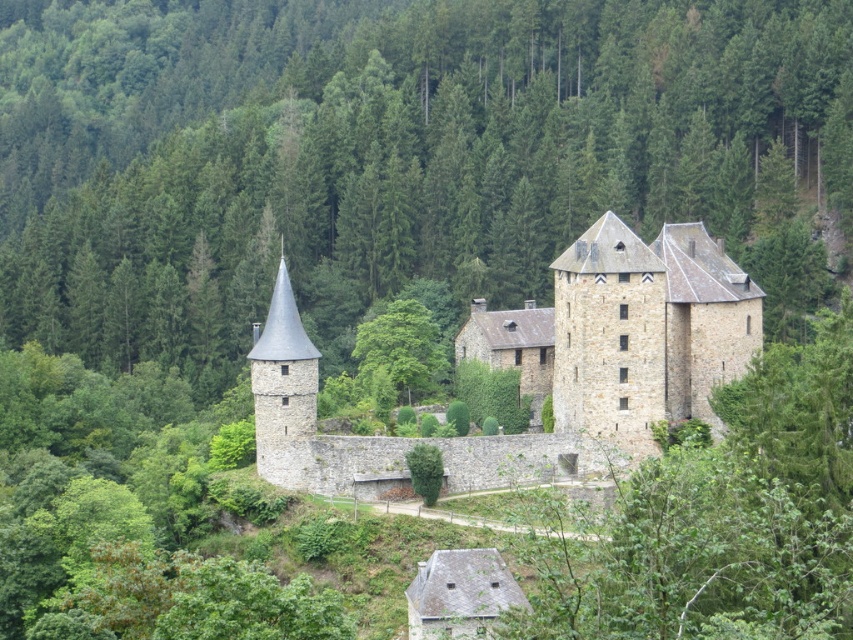
Question: Does green leafy tree at center appear over stone spire at left?

Choices:
 (A) yes
 (B) no

Answer: (A)

Question: Which point appears closest to the camera in this image?

Choices:
 (A) (303, 433)
 (B) (378, 272)

Answer: (A)

Question: Is green leafy tree at center above stone spire at left?

Choices:
 (A) yes
 (B) no

Answer: (A)

Question: Is green leafy tree at center wider than stone castle at center?

Choices:
 (A) no
 (B) yes

Answer: (B)

Question: Considering the real-world distances, which object is farthest from the stone spire at left?

Choices:
 (A) stone castle at center
 (B) green leafy tree at center

Answer: (B)

Question: Which of the following is the closest to the observer?

Choices:
 (A) (198, 124)
 (B) (299, 484)

Answer: (B)